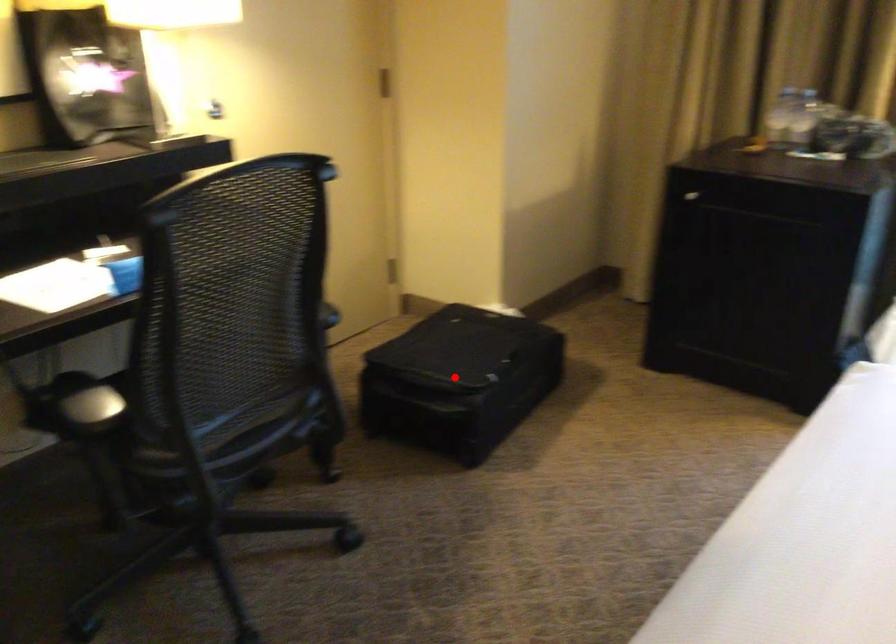
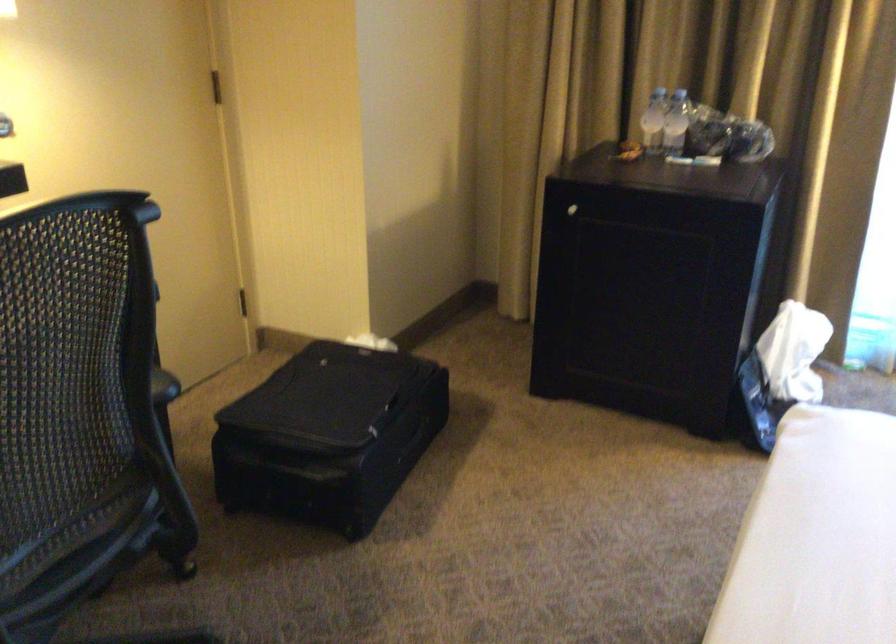
Question: I am providing you with two images of the same scene from different viewpoints. In image1, a red point is highlighted. Considering the same 3D point in image2, which of the following is correct?

Choices:
 (A) It is closer
 (B) It is farther

Answer: (A)